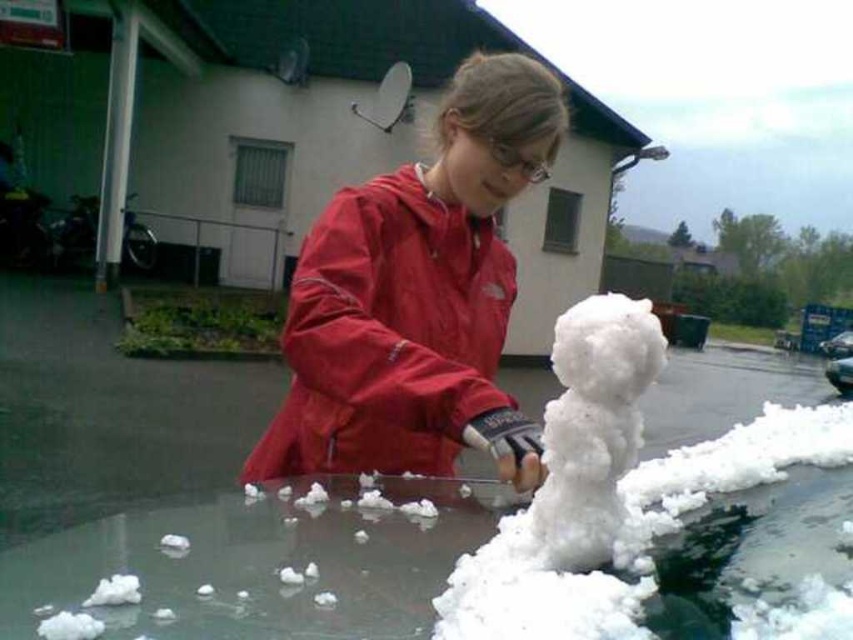
You are a delivery driver who needs to park your shiny black car at lower right near the building. However, there is a white fluffy snowman at center in the way. Can you park your car there without moving the snowman?

The white fluffy snowman at center is smaller than the shiny black car at lower right. Since the snowman is smaller, it might not block the parking space entirely, but you should check the exact dimensions to ensure there is enough space.

You are standing at the satellite dish on the building roof. You see two points, point (x=485, y=412) and point (x=556, y=531). Which point is closer to you?

Point (x=556, y=531) is closer to you because point (x=485, y=412) is behind point (x=556, y=531).